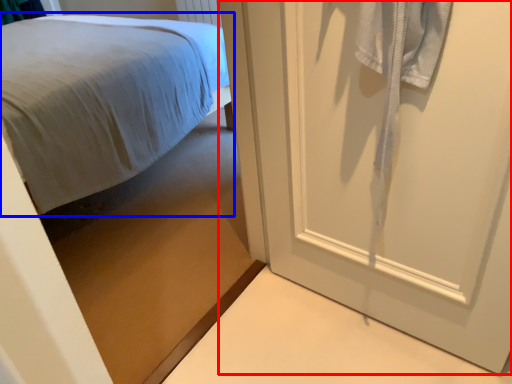
Question: Which point is closer to the camera, door (highlighted by a red box) or bed (highlighted by a blue box)?

Choices:
 (A) door
 (B) bed

Answer: (A)